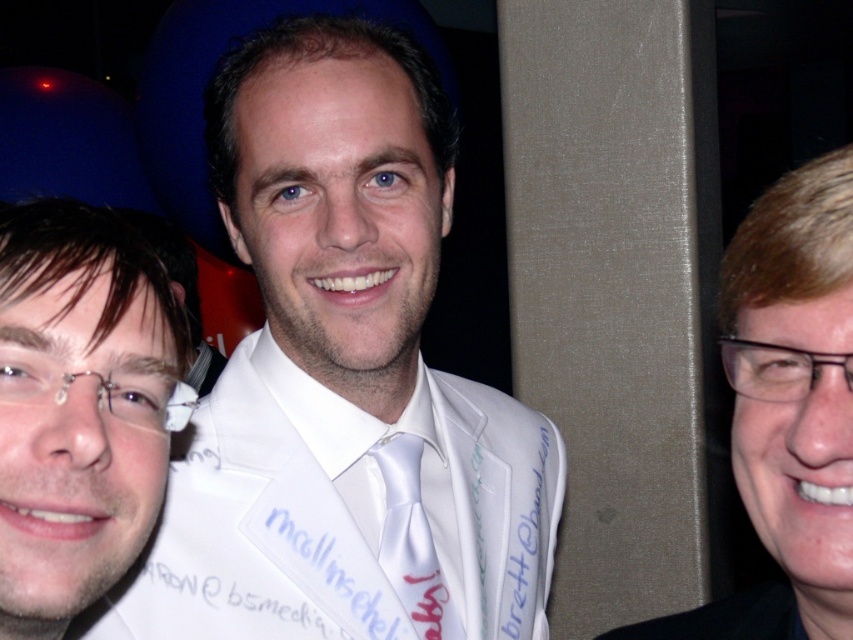
Does point (370, 209) come closer to viewer compared to point (28, 604)?

No, (370, 209) is behind (28, 604).

Who is shorter, white satin suit at center or matte white shirt at center?

matte white shirt at center is shorter.

Between point (347, 96) and point (19, 506), which one is positioned behind?

The point (347, 96) is behind.

Where is `white satin suit at center`? This screenshot has height=640, width=853. white satin suit at center is located at coordinates (343, 380).

Can you confirm if matte white shirt at center is thinner than white satin tie at center?

No, matte white shirt at center is not thinner than white satin tie at center.

Can you confirm if matte white shirt at center is positioned below white satin tie at center?

Actually, matte white shirt at center is above white satin tie at center.

Describe the element at coordinates (78, 406) in the screenshot. Image resolution: width=853 pixels, height=640 pixels. I see `matte white shirt at center` at that location.

Where is `matte white shirt at center`? The image size is (853, 640). matte white shirt at center is located at coordinates 78,406.

Who is more forward, (711, 632) or (416, 602)?

Point (711, 632) is in front.

This screenshot has height=640, width=853. Describe the element at coordinates (787, 410) in the screenshot. I see `black glossy hair at right` at that location.

Image resolution: width=853 pixels, height=640 pixels. Identify the location of black glossy hair at right. (787, 410).